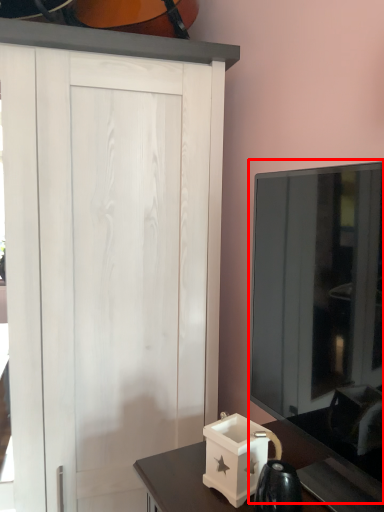
Question: From the image's perspective, what is the correct spatial relationship of glass door (annotated by the red box) in relation to box?

Choices:
 (A) below
 (B) above

Answer: (B)